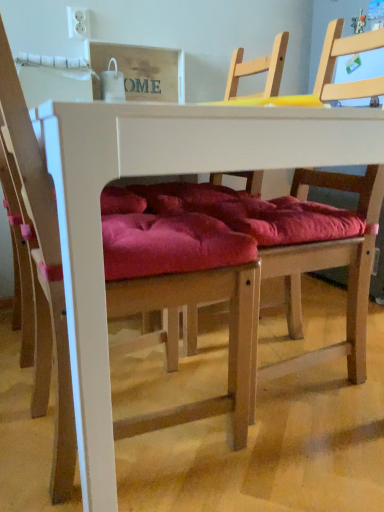
Question: Is wooden chair at center, the 2th chair from the left, oriented away from white matte table at center?

Choices:
 (A) no
 (B) yes

Answer: (B)

Question: Is wooden chair at center, the 2th chair from the left, taller than white matte table at center?

Choices:
 (A) yes
 (B) no

Answer: (A)

Question: Considering the relative sizes of wooden chair at center, the 2th chair from the left, and white matte table at center in the image provided, is wooden chair at center, the 2th chair from the left, thinner than white matte table at center?

Choices:
 (A) yes
 (B) no

Answer: (A)

Question: From a real-world perspective, is wooden chair at center, placed as the first chair when sorted from right to left, positioned over white matte table at center based on gravity?

Choices:
 (A) no
 (B) yes

Answer: (B)

Question: Can you confirm if wooden chair at center, the 2th chair from the left, is positioned to the right of white matte table at center?

Choices:
 (A) no
 (B) yes

Answer: (B)

Question: In terms of height, does wooden chair at center, the 2th chair from the left, look taller or shorter compared to white matte table at center?

Choices:
 (A) tall
 (B) short

Answer: (A)

Question: Looking at the image, does wooden chair at center, placed as the first chair when sorted from right to left, seem bigger or smaller compared to white matte table at center?

Choices:
 (A) big
 (B) small

Answer: (B)

Question: Considering the positions of wooden chair at center, the 2th chair from the left, and white matte table at center in the image, is wooden chair at center, the 2th chair from the left, wider or thinner than white matte table at center?

Choices:
 (A) wide
 (B) thin

Answer: (B)

Question: Is point (185, 350) closer or farther from the camera than point (109, 412)?

Choices:
 (A) closer
 (B) farther

Answer: (B)

Question: In the image, is white matte table at center on the left side or the right side of wooden chair at center, placed as the first chair when sorted from right to left?

Choices:
 (A) right
 (B) left

Answer: (B)

Question: Based on their sizes in the image, would you say white matte table at center is bigger or smaller than wooden chair at center, placed as the first chair when sorted from right to left?

Choices:
 (A) small
 (B) big

Answer: (B)

Question: Is point (276, 117) positioned closer to the camera than point (336, 19)?

Choices:
 (A) farther
 (B) closer

Answer: (B)

Question: Considering the positions of white matte table at center and wooden chair at center, the 2th chair from the left, in the image, is white matte table at center wider or thinner than wooden chair at center, the 2th chair from the left,?

Choices:
 (A) wide
 (B) thin

Answer: (A)

Question: Is velvet red cushion at center, placed as the 2th chair when sorted from right to left, wider or thinner than wooden chair at center, placed as the first chair when sorted from right to left?

Choices:
 (A) thin
 (B) wide

Answer: (A)

Question: Considering the positions of point (248, 346) and point (261, 58), is point (248, 346) closer or farther from the camera than point (261, 58)?

Choices:
 (A) closer
 (B) farther

Answer: (A)